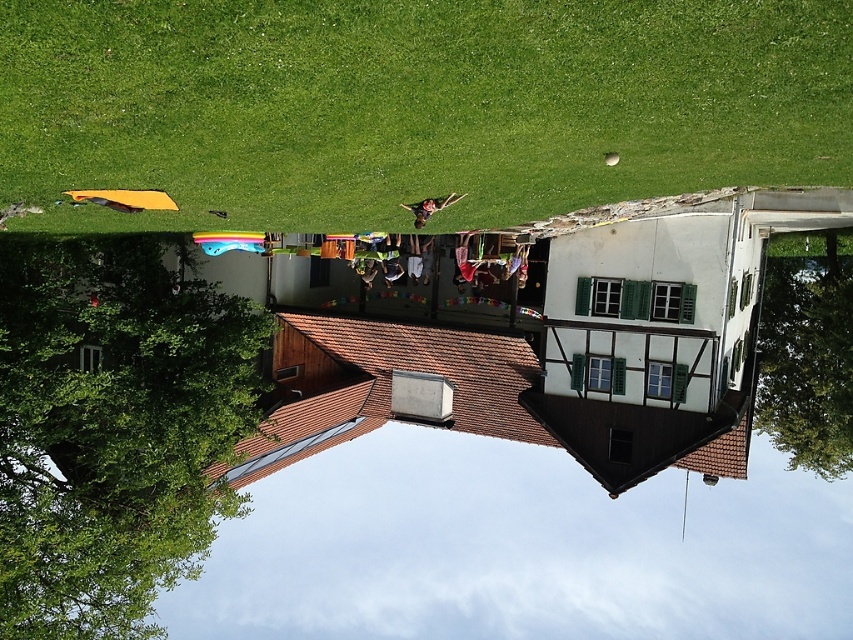
You are standing at the entrance of the house and want to see both the green grass at upper left and the green leafy tree at left. Which one will appear closer to you?

The green grass at upper left appears closer to you because it is not as tall as the green leafy tree at left, so the tree is further away.

You are standing at the entrance of the house and want to determine which object is taller between the green grass at upper left and the green leafy tree at lower right. Based on the scene, which one is taller?

The green grass at upper left has a lesser height compared to the green leafy tree at lower right, so the green leafy tree at lower right is taller.